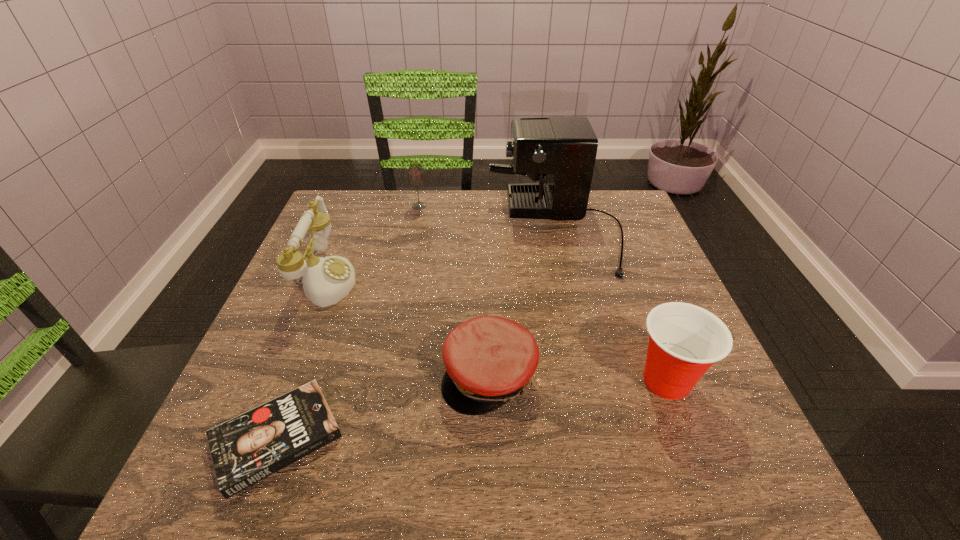
Locate an element on the screen. free point between the glass drink container and the second tallest object is located at coordinates (372, 243).

Locate an element on the screen. The width and height of the screenshot is (960, 540). vacant area that lies between the cup and the glass drink container is located at coordinates (542, 294).

Where is `vacant area that lies between the cup and the tallest object`? The width and height of the screenshot is (960, 540). vacant area that lies between the cup and the tallest object is located at coordinates click(x=611, y=305).

Identify the location of vacant area between the coffee maker and the fifth shortest object. The width and height of the screenshot is (960, 540). (441, 254).

Identify the location of free space between the cup and the tallest object. (611, 305).

Select which object is the closest to the coffee maker. Please provide its 2D coordinates. Your answer should be formatted as a tuple, i.e. [(x, y)], where the tuple contains the x and y coordinates of a point satisfying the conditions above.

[(416, 178)]

What are the coordinates of `object identified as the closest to the glass drink container` in the screenshot? It's located at (564, 149).

Find the location of a particular element. free spot that satisfies the following two spatial constraints: 1. on the dial of the shortest object; 2. on the right side of the fifth shortest object is located at coordinates (263, 438).

At what (x,y) coordinates should I click in order to perform the action: click on free location that satisfies the following two spatial constraints: 1. on the dial of the shortest object; 2. on the right side of the fifth shortest object. Please return your answer as a coordinate pair (x, y). Image resolution: width=960 pixels, height=540 pixels. Looking at the image, I should click on (263, 438).

The width and height of the screenshot is (960, 540). What are the coordinates of `blank area in the image that satisfies the following two spatial constraints: 1. on the back side of the book; 2. on the dial of the telephone` in the screenshot? It's located at [x=336, y=279].